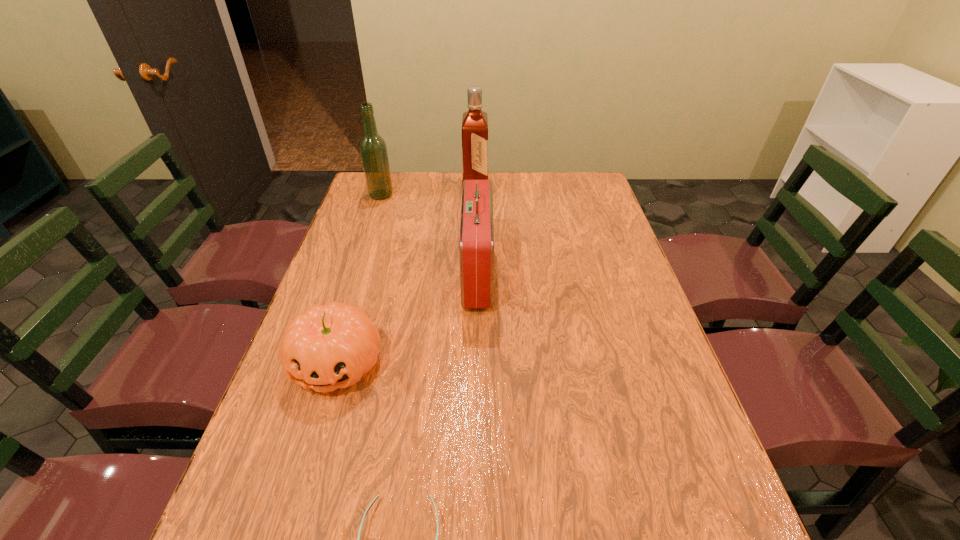
Identify which object is the nearest to the nearest object. Please provide its 2D coordinates. Your answer should be formatted as a tuple, i.e. [(x, y)], where the tuple contains the x and y coordinates of a point satisfying the conditions above.

[(331, 346)]

Locate which object is the closest to the nearest object. Please provide its 2D coordinates. Your answer should be formatted as a tuple, i.e. [(x, y)], where the tuple contains the x and y coordinates of a point satisfying the conditions above.

[(331, 346)]

Find the location of a particular element. This screenshot has width=960, height=540. vacant region that satisfies the following two spatial constraints: 1. on the side of the third nearest object with the first aid cross symbol; 2. on the carved face of the pumpkin is located at coordinates (477, 363).

This screenshot has width=960, height=540. I want to click on vacant space that satisfies the following two spatial constraints: 1. on the front label of the right liquor; 2. on the carved face of the second nearest object, so click(x=473, y=363).

Identify the location of vacant space that satisfies the following two spatial constraints: 1. on the side of the third tallest object with the first aid cross symbol; 2. on the carved face of the second shortest object. (477, 363).

Identify the location of free region that satisfies the following two spatial constraints: 1. on the side of the third shortest object with the first aid cross symbol; 2. on the carved face of the pumpkin. (477, 363).

Where is `vacant space that satisfies the following two spatial constraints: 1. on the side of the first-aid kit with the first aid cross symbol; 2. on the carved face of the pumpkin`? The width and height of the screenshot is (960, 540). vacant space that satisfies the following two spatial constraints: 1. on the side of the first-aid kit with the first aid cross symbol; 2. on the carved face of the pumpkin is located at coordinates [x=477, y=363].